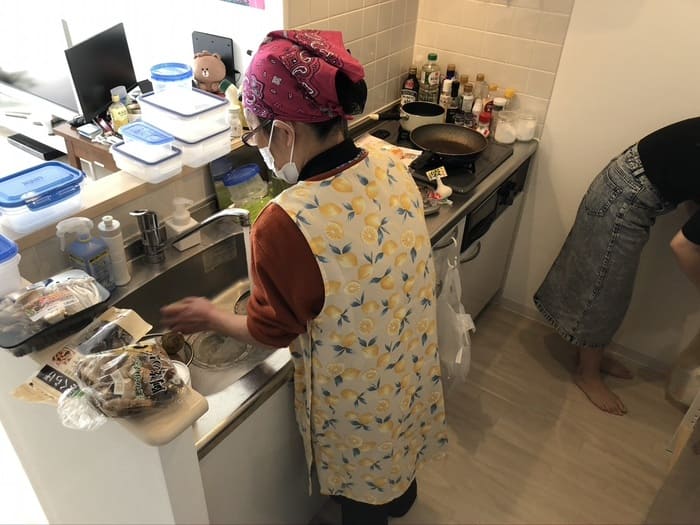
Identify the location of faucet. The image size is (700, 525). (155, 241).